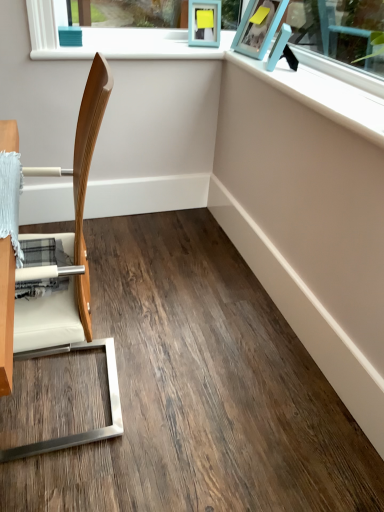
You are a GUI agent. You are given a task and a screenshot of the screen. Output one action in this format:
    pyautogui.click(x=<x>, y=<y>)
    Task: Click on the vacant position to the left of matte blue picture frame at upper right, marked as the first picture frame in a right-to-left arrangement
    This screenshot has height=512, width=384.
    Given the screenshot: What is the action you would take?
    pyautogui.click(x=259, y=64)